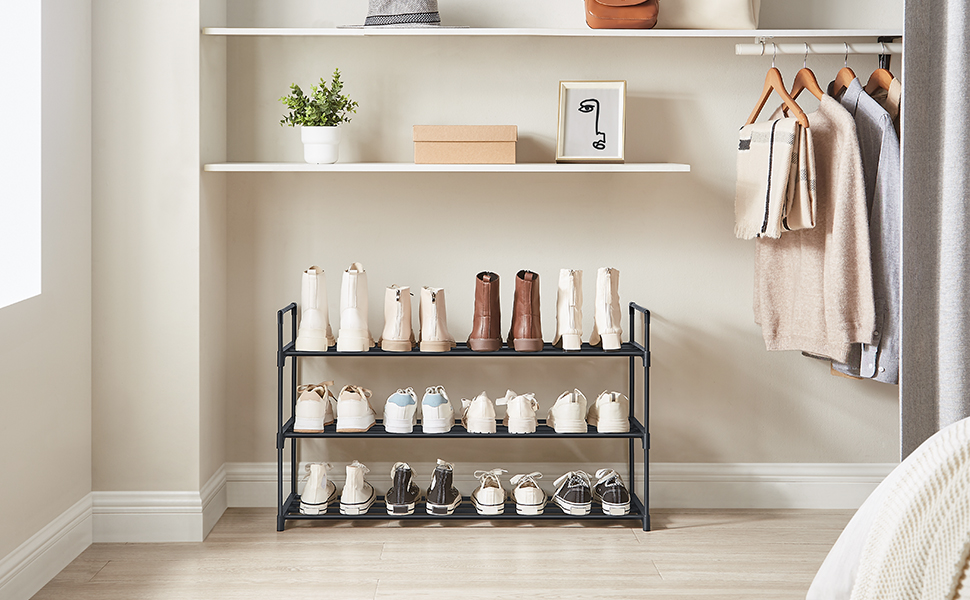
At what (x,y) coordinates should I click in order to perform the action: click on items on shelves. Please return your answer as a coordinate pair (x, y). The image size is (970, 600). Looking at the image, I should click on (322, 128), (471, 151), (586, 146), (410, 12), (590, 15).